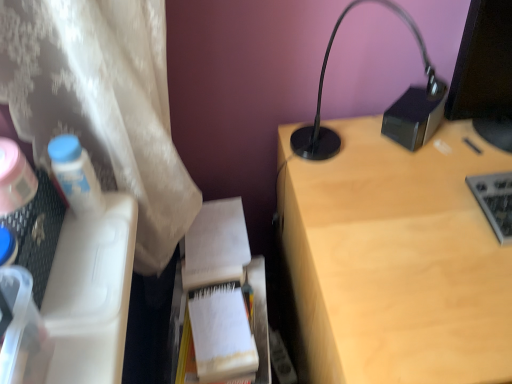
The height and width of the screenshot is (384, 512). I want to click on free spot below black metallic lamp at upper right (from a real-world perspective), so click(x=348, y=165).